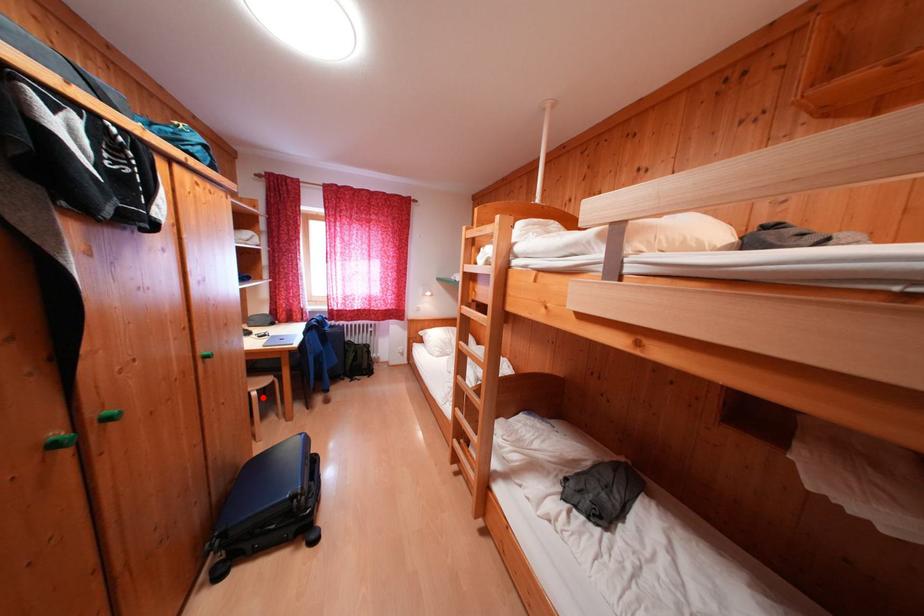
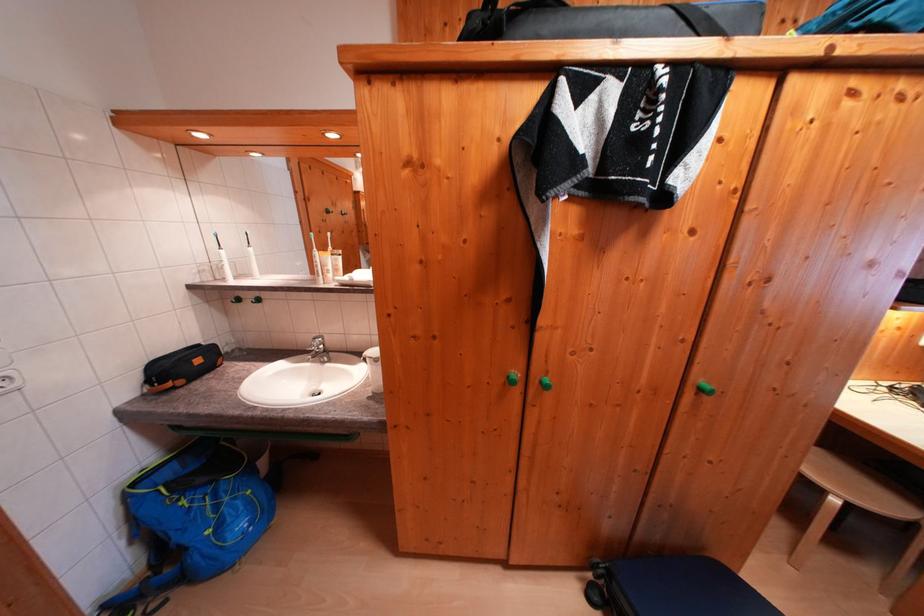
In the second image, find the point that corresponds to the highlighted location in the first image.

(843, 505)